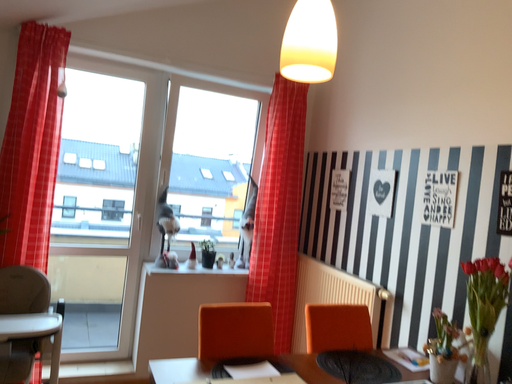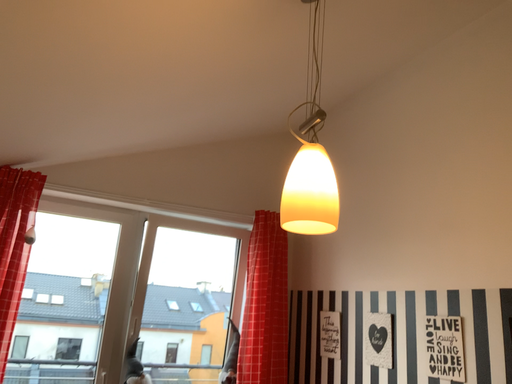
Question: How did the camera likely rotate when shooting the video?

Choices:
 (A) rotated upward
 (B) rotated downward

Answer: (A)